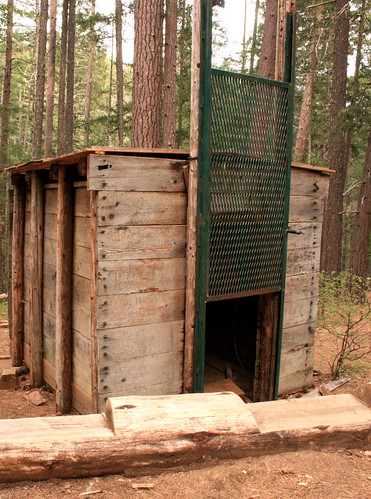
The width and height of the screenshot is (371, 499). What are the coordinates of `right of door` in the screenshot? It's located at (308, 288).